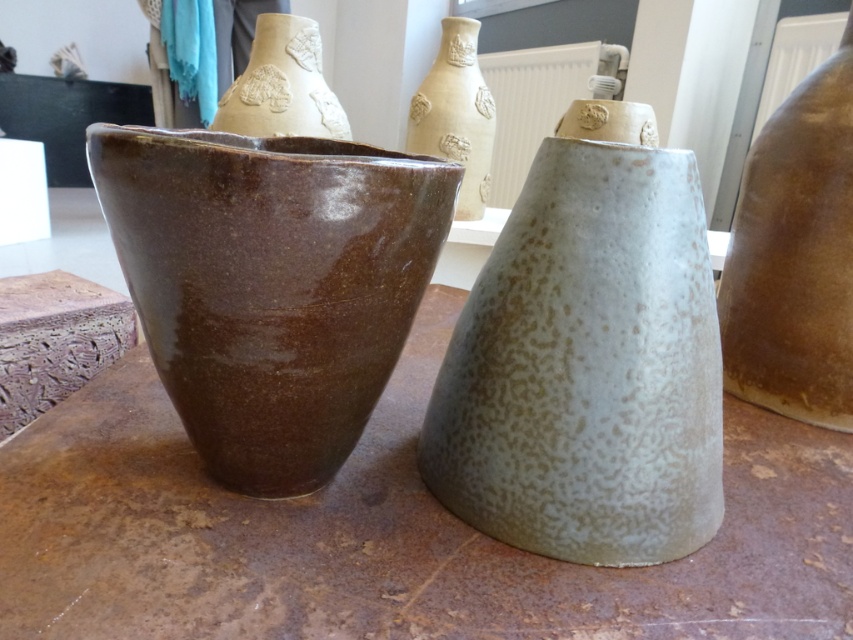
You are arranging flowers for a client and need to place a bouquet that requires 8 inches of space between the two vases. Given the current placement of the speckled ceramic vase at center and the brown glossy vase at left, is the distance sufficient?

The speckled ceramic vase at center and the brown glossy vase at left are 7.38 inches apart from each other, which is less than the required 8 inches. Therefore, the distance is not sufficient for the bouquet.

You are an interior designer arranging a display. You have a brown matte vase at right and a matte beige vase at upper center. Which vase is positioned lower on the display surface?

The brown matte vase at right is located below the matte beige vase at upper center, so it is positioned lower on the display surface.